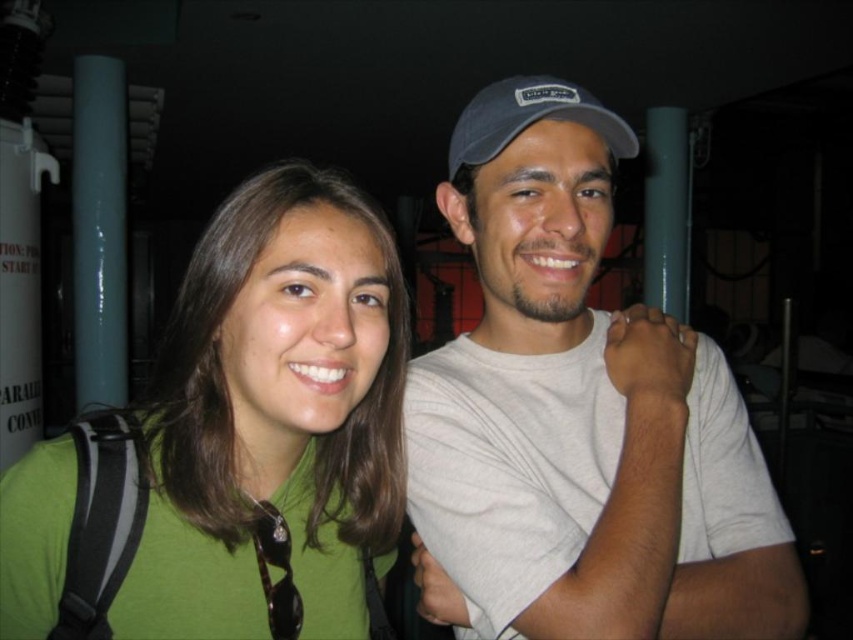
Consider the image. Which of these two, white matte t-shirt at center or green matte shirt at center, stands taller?

white matte t-shirt at center is taller.

Where is `white matte t-shirt at center`? The height and width of the screenshot is (640, 853). white matte t-shirt at center is located at coordinates (581, 413).

Who is more distant from viewer, (512, 426) or (161, 390)?

The point (512, 426) is more distant.

At what (x,y) coordinates should I click in order to perform the action: click on white matte t-shirt at center. Please return your answer as a coordinate pair (x, y). Looking at the image, I should click on (581, 413).

Can you confirm if green matte shirt at center is positioned above blue fabric baseball cap at upper center?

No, green matte shirt at center is not above blue fabric baseball cap at upper center.

From the picture: Does green matte shirt at center have a greater width compared to blue fabric baseball cap at upper center?

Correct, the width of green matte shirt at center exceeds that of blue fabric baseball cap at upper center.

The width and height of the screenshot is (853, 640). What do you see at coordinates (274, 422) in the screenshot?
I see `green matte shirt at center` at bounding box center [274, 422].

Locate an element on the screen. The height and width of the screenshot is (640, 853). green matte shirt at center is located at coordinates (274, 422).

Who is more forward, (x=776, y=634) or (x=456, y=164)?

Point (x=776, y=634) is in front.

Is white matte t-shirt at center positioned at the back of blue fabric baseball cap at upper center?

That is False.

Is point (688, 337) behind point (498, 122)?

Yes.

Find the location of a particular element. white matte t-shirt at center is located at coordinates (x=581, y=413).